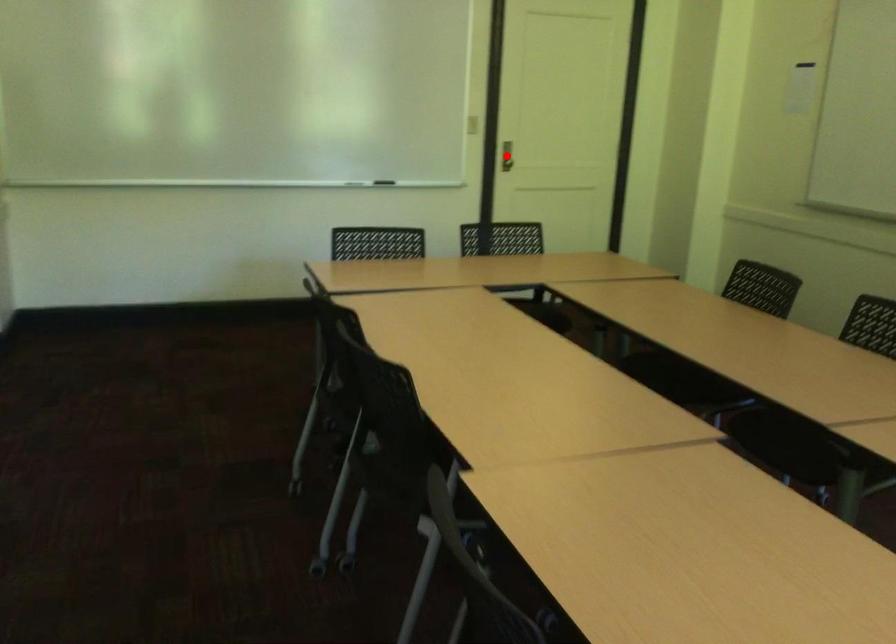
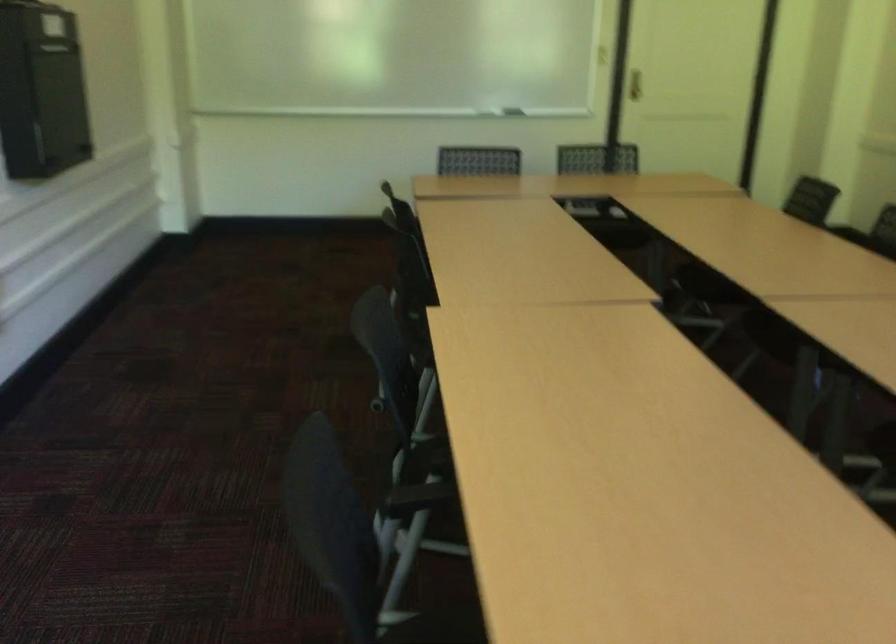
Question: I am providing you with two images of the same scene from different viewpoints. A red point is marked on the first image. Can you still see the location of the red point in image 2?

Choices:
 (A) Yes
 (B) No

Answer: (B)